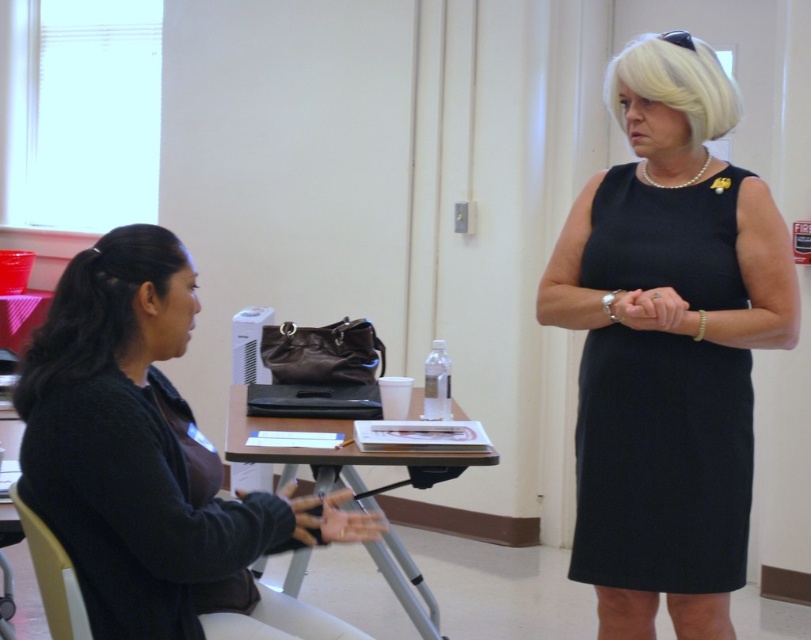
Question: Which point is farther from the camera taking this photo?

Choices:
 (A) 79,365
 (B) 580,548
 (C) 65,593

Answer: (B)

Question: Is black hair at left to the right of white plastic chair at lower left from the viewer's perspective?

Choices:
 (A) yes
 (B) no

Answer: (A)

Question: Estimate the real-world distances between objects in this image. Which object is farther from the matte black table at center?

Choices:
 (A) blonde hair at upper right
 (B) black fabric dress at center
 (C) white plastic chair at lower left
 (D) dark gray sweater at left

Answer: (A)

Question: Is blonde hair at upper right positioned in front of white plastic chair at lower left?

Choices:
 (A) yes
 (B) no

Answer: (B)

Question: Considering the relative positions of black fabric dress at center and matte black table at center in the image provided, where is black fabric dress at center located with respect to matte black table at center?

Choices:
 (A) right
 (B) left

Answer: (A)

Question: Which is nearer to the black fabric dress at center?

Choices:
 (A) matte black table at center
 (B) blonde hair at upper right
 (C) white plastic chair at lower left

Answer: (B)